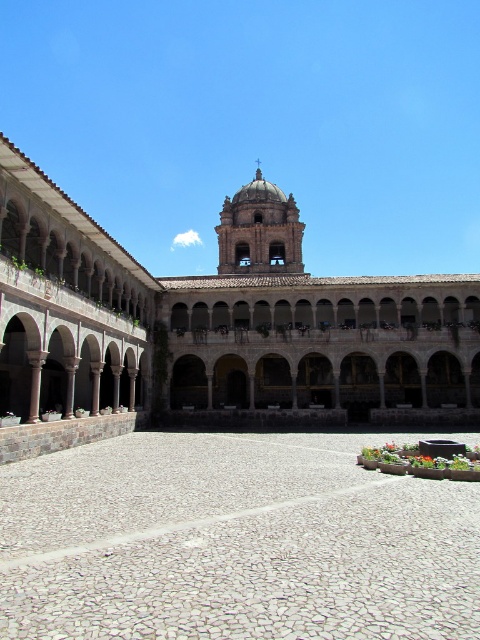
Which of these two, stone arches at center or white pebble courtyard at center, stands shorter?

white pebble courtyard at center

Does stone arches at center appear on the left side of white pebble courtyard at center?

In fact, stone arches at center is to the right of white pebble courtyard at center.

Find the location of `stone arches at center`. stone arches at center is located at coordinates (213, 328).